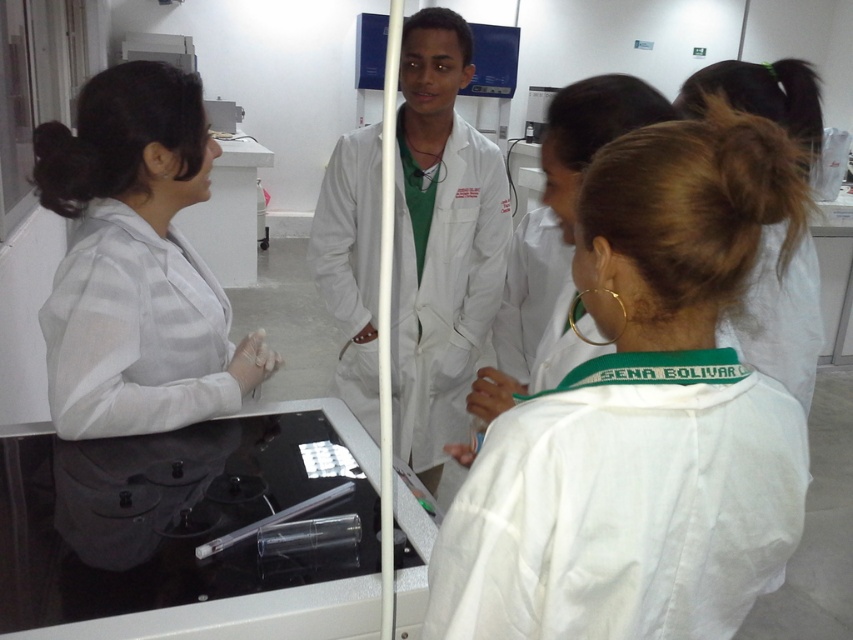
In the laboratory scene, you notice a white matte lab coat at center and a black glass tray at lower left. Which object is positioned to the right of the other?

The white matte lab coat at center is positioned to the right of the black glass tray at lower left.

Looking at this image, you are a new intern in the lab and need to locate the white matte lab coat at center. According to the lab map coordinates, where should you look to find it?

The white matte lab coat at center is located at coordinates point (x=642, y=417).